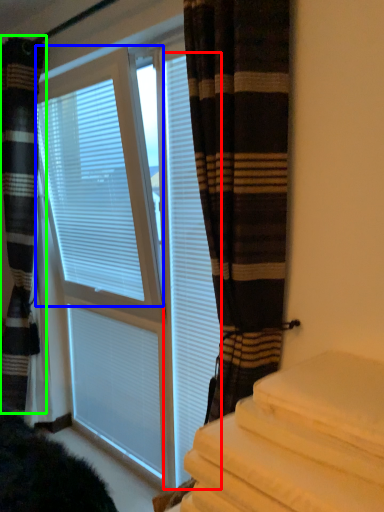
Question: Estimate the real-world distances between objects in this image. Which object is farther from shutter (highlighted by a red box), window blind (highlighted by a blue box) or curtain (highlighted by a green box)?

Choices:
 (A) window blind
 (B) curtain

Answer: (B)